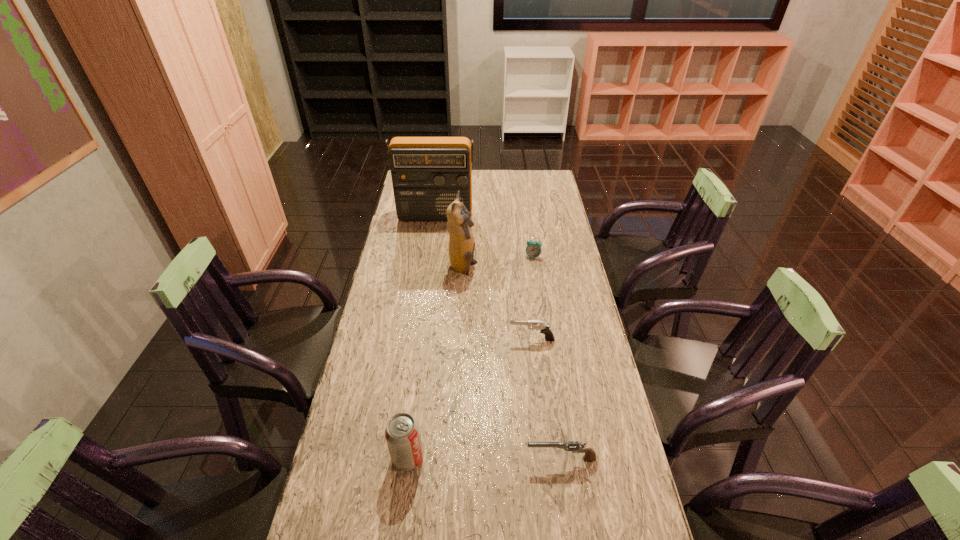
This screenshot has width=960, height=540. In order to click on the farthest object in this screenshot , I will do `click(427, 172)`.

The width and height of the screenshot is (960, 540). What are the coordinates of `cat` in the screenshot? It's located at (461, 244).

This screenshot has width=960, height=540. I want to click on soda can, so click(402, 434).

I want to click on the farther gun, so click(x=544, y=328).

Locate an element on the screen. This screenshot has height=540, width=960. alarm clock is located at coordinates (533, 249).

I want to click on the shorter gun, so click(576, 447).

Locate an element on the screen. This screenshot has width=960, height=540. vacant space positioned on the front-facing side of the farthest object is located at coordinates (427, 271).

Locate an element on the screen. This screenshot has height=540, width=960. free region located 0.190m on the face of the third farthest object is located at coordinates (526, 268).

I want to click on vacant space located on the right of the soda can, so click(493, 457).

Image resolution: width=960 pixels, height=540 pixels. I want to click on vacant space located at the muzzle of the farther gun, so click(411, 339).